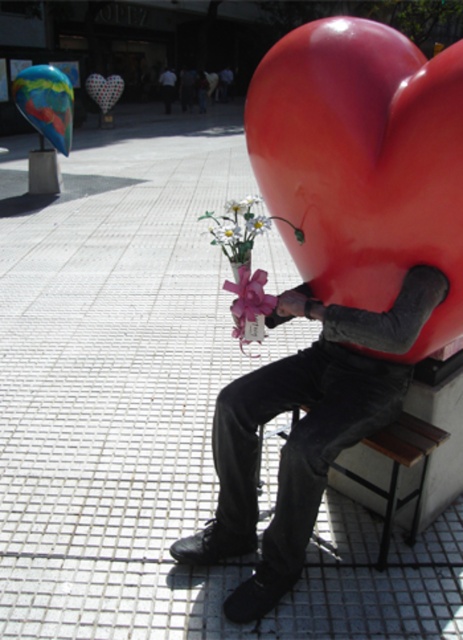
Question: Which point appears closest to the camera in this image?

Choices:
 (A) tap(321, 49)
 (B) tap(237, 292)
 (C) tap(166, 81)

Answer: (A)

Question: Which of the following is the farthest from the observer?

Choices:
 (A) (241, 262)
 (B) (163, 76)

Answer: (B)

Question: Does matte black pants at center appear under white matte flower at center?

Choices:
 (A) yes
 (B) no

Answer: (A)

Question: Is glossy plastic heart at right positioned at the back of black matte pants at lower center?

Choices:
 (A) yes
 (B) no

Answer: (B)

Question: Which object is the closest to the white matte flower at center?

Choices:
 (A) black matte pants at lower center
 (B) pink silk flower at center
 (C) white paper flower at center

Answer: (C)

Question: Is white paper flower at center positioned behind white matte flower at center?

Choices:
 (A) yes
 (B) no

Answer: (A)